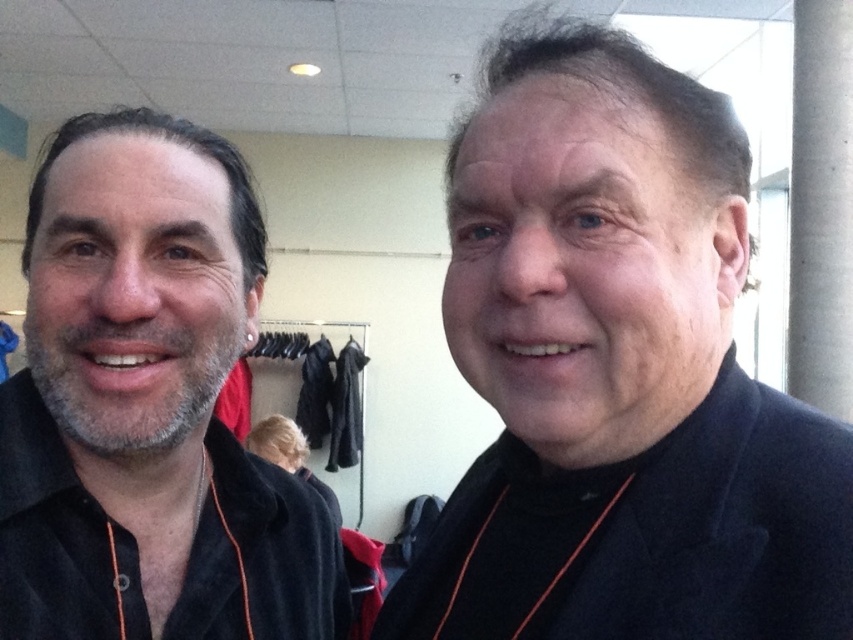
You are a costume designer preparing for a play. You have two items to place on a rack. The black matte jacket at right and the matte black shirt at left. Which item should you place higher on the rack to ensure it doesn

The black matte jacket at right should be placed higher on the rack because it has a greater height compared to the matte black shirt at left.

You are a photographer trying to focus on the matte black shirt at left. You know the camera focuses on the point at coordinates (148, 406). Is the matte black shirt at left in focus?

The matte black shirt at left is located at point (148, 406), so yes, the matte black shirt at left is in focus because the camera focuses on that point.